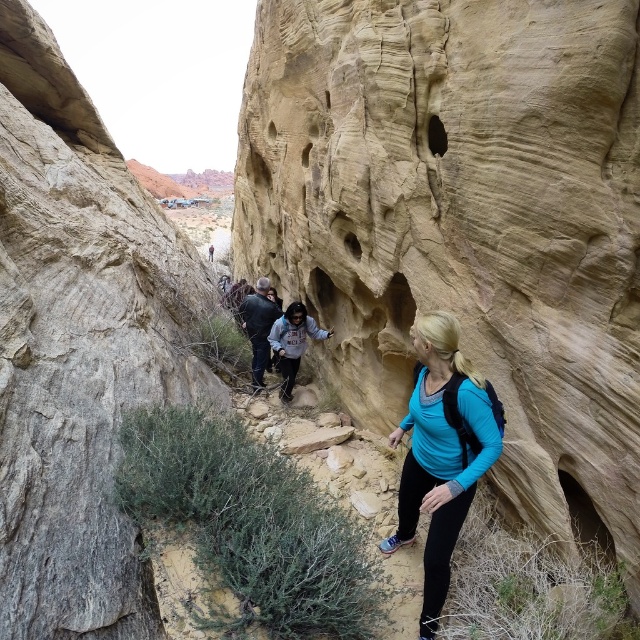
Question: Among these points, which one is farthest from the camera?

Choices:
 (A) (259, 336)
 (B) (433, 548)

Answer: (A)

Question: Which of the following is the closest to the observer?

Choices:
 (A) blue fabric backpack at center
 (B) gray textured rock at left
 (C) dark blue jeans at center

Answer: (B)

Question: Does smooth sandstone rock face at center appear under dark blue jeans at center?

Choices:
 (A) no
 (B) yes

Answer: (A)

Question: Considering the relative positions of smooth sandstone rock face at center and blue fabric backpack at center in the image provided, where is smooth sandstone rock face at center located with respect to blue fabric backpack at center?

Choices:
 (A) right
 (B) left

Answer: (B)

Question: Can you confirm if blue fabric backpack at center is thinner than dark blue jeans at center?

Choices:
 (A) yes
 (B) no

Answer: (A)

Question: Considering the real-world distances, which object is closest to the dark blue jeans at center?

Choices:
 (A) smooth sandstone rock face at center
 (B) gray textured rock at left

Answer: (B)